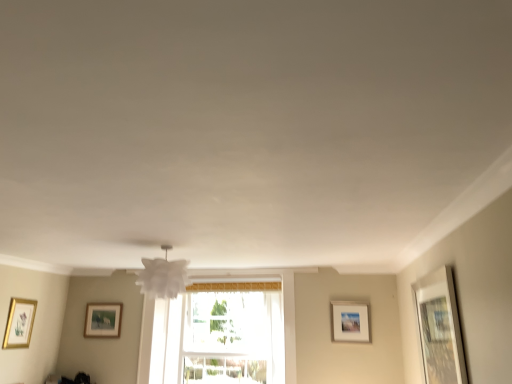
Question: Is white matte picture frame at upper right, placed as the 3th picture frame when sorted from left to right, at the right side of gold-framed picture at left, the 1th picture frame in the left-to-right sequence?

Choices:
 (A) no
 (B) yes

Answer: (B)

Question: Is the depth of white matte picture frame at upper right, the second picture frame in the back-to-front sequence, less than that of gold-framed picture at left, the third picture frame viewed from the back?

Choices:
 (A) no
 (B) yes

Answer: (A)

Question: From a real-world perspective, does white matte picture frame at upper right, the 3th picture frame positioned from the front, stand above gold-framed picture at left, the 4th picture frame from the right?

Choices:
 (A) no
 (B) yes

Answer: (B)

Question: Is gold-framed picture at left, the 4th picture frame from the right, completely or partially inside white matte picture frame at upper right, placed as the 3th picture frame when sorted from left to right?

Choices:
 (A) no
 (B) yes

Answer: (A)

Question: Considering the relative sizes of white matte picture frame at upper right, the 2th picture frame when ordered from right to left, and gold-framed picture at left, the 4th picture frame from the right, in the image provided, is white matte picture frame at upper right, the 2th picture frame when ordered from right to left, wider than gold-framed picture at left, the 4th picture frame from the right,?

Choices:
 (A) no
 (B) yes

Answer: (B)

Question: Is point (332, 332) closer or farther from the camera than point (147, 269)?

Choices:
 (A) farther
 (B) closer

Answer: (A)

Question: Is white matte picture frame at upper right, the second picture frame in the back-to-front sequence, in front of or behind white paper lampshade at center in the image?

Choices:
 (A) behind
 (B) front

Answer: (A)

Question: From the image's perspective, is white matte picture frame at upper right, placed as the 3th picture frame when sorted from left to right, above or below white paper lampshade at center?

Choices:
 (A) above
 (B) below

Answer: (B)

Question: Is white matte picture frame at upper right, the second picture frame in the back-to-front sequence, taller or shorter than white paper lampshade at center?

Choices:
 (A) tall
 (B) short

Answer: (A)

Question: From their relative heights in the image, would you say white paper lampshade at center is taller or shorter than white matte picture frame at upper right, the 3th picture frame positioned from the front?

Choices:
 (A) short
 (B) tall

Answer: (A)

Question: From the image's perspective, is white paper lampshade at center located above or below white matte picture frame at upper right, the second picture frame in the back-to-front sequence?

Choices:
 (A) above
 (B) below

Answer: (A)

Question: Is white paper lampshade at center inside the boundaries of white matte picture frame at upper right, placed as the 3th picture frame when sorted from left to right, or outside?

Choices:
 (A) inside
 (B) outside

Answer: (B)

Question: In terms of size, does white paper lampshade at center appear bigger or smaller than white matte picture frame at upper right, the 2th picture frame when ordered from right to left?

Choices:
 (A) big
 (B) small

Answer: (A)

Question: Relative to gold-framed picture at left, the third picture frame viewed from the back, is wooden picture frame at right, the 1th picture frame when ordered from right to left, in front or behind?

Choices:
 (A) front
 (B) behind

Answer: (A)

Question: From the image's perspective, is wooden picture frame at right, marked as the 4th picture frame in a back-to-front arrangement, positioned above or below gold-framed picture at left, the 4th picture frame from the right?

Choices:
 (A) above
 (B) below

Answer: (A)